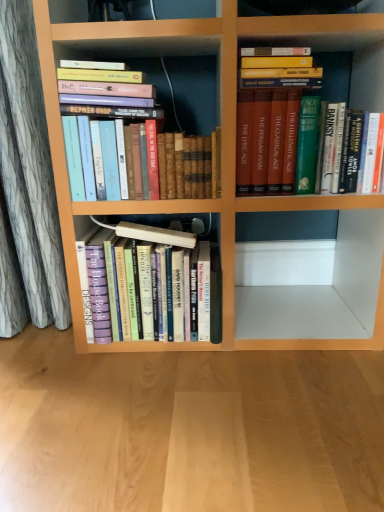
Question: Is wooden floor at lower center thinner than green hardcover book at upper right, marked as the third book in a left-to-right arrangement?

Choices:
 (A) yes
 (B) no

Answer: (B)

Question: Is wooden floor at lower center placed right next to green hardcover book at upper right, marked as the third book in a left-to-right arrangement?

Choices:
 (A) yes
 (B) no

Answer: (B)

Question: Considering the relative sizes of wooden floor at lower center and green hardcover book at upper right, marked as the third book in a left-to-right arrangement, in the image provided, is wooden floor at lower center smaller than green hardcover book at upper right, marked as the third book in a left-to-right arrangement,?

Choices:
 (A) yes
 (B) no

Answer: (B)

Question: From the image's perspective, is wooden floor at lower center on top of green hardcover book at upper right, marked as the third book in a left-to-right arrangement?

Choices:
 (A) yes
 (B) no

Answer: (B)

Question: Is wooden floor at lower center positioned before green hardcover book at upper right, the first book in the right-to-left sequence?

Choices:
 (A) yes
 (B) no

Answer: (A)

Question: Considering the positions of point (246, 413) and point (269, 112), is point (246, 413) closer or farther from the camera than point (269, 112)?

Choices:
 (A) farther
 (B) closer

Answer: (B)

Question: From a real-world perspective, is wooden floor at lower center physically located above or below green hardcover book at upper right, marked as the third book in a left-to-right arrangement?

Choices:
 (A) below
 (B) above

Answer: (A)

Question: Is wooden floor at lower center bigger or smaller than green hardcover book at upper right, marked as the third book in a left-to-right arrangement?

Choices:
 (A) small
 (B) big

Answer: (B)

Question: Considering the positions of wooden floor at lower center and green hardcover book at upper right, the first book in the right-to-left sequence, in the image, is wooden floor at lower center taller or shorter than green hardcover book at upper right, the first book in the right-to-left sequence,?

Choices:
 (A) short
 (B) tall

Answer: (A)

Question: Which is correct: hardcover books at center, arranged as the second book when viewed from the left, is inside wooden floor at lower center, or outside of it?

Choices:
 (A) outside
 (B) inside

Answer: (A)

Question: Is hardcover books at center, arranged as the second book when viewed from the left, wider or thinner than wooden floor at lower center?

Choices:
 (A) thin
 (B) wide

Answer: (A)

Question: Is hardcover books at center, which ranks as the 2th book in right-to-left order, to the left or to the right of wooden floor at lower center in the image?

Choices:
 (A) left
 (B) right

Answer: (A)

Question: Considering the positions of hardcover books at center, arranged as the second book when viewed from the left, and wooden floor at lower center in the image, is hardcover books at center, arranged as the second book when viewed from the left, bigger or smaller than wooden floor at lower center?

Choices:
 (A) small
 (B) big

Answer: (A)

Question: Is point (244, 120) closer or farther from the camera than point (281, 439)?

Choices:
 (A) closer
 (B) farther

Answer: (B)

Question: From the image's perspective, relative to wooden floor at lower center, is green hardcover book at upper right, marked as the third book in a left-to-right arrangement, above or below?

Choices:
 (A) above
 (B) below

Answer: (A)